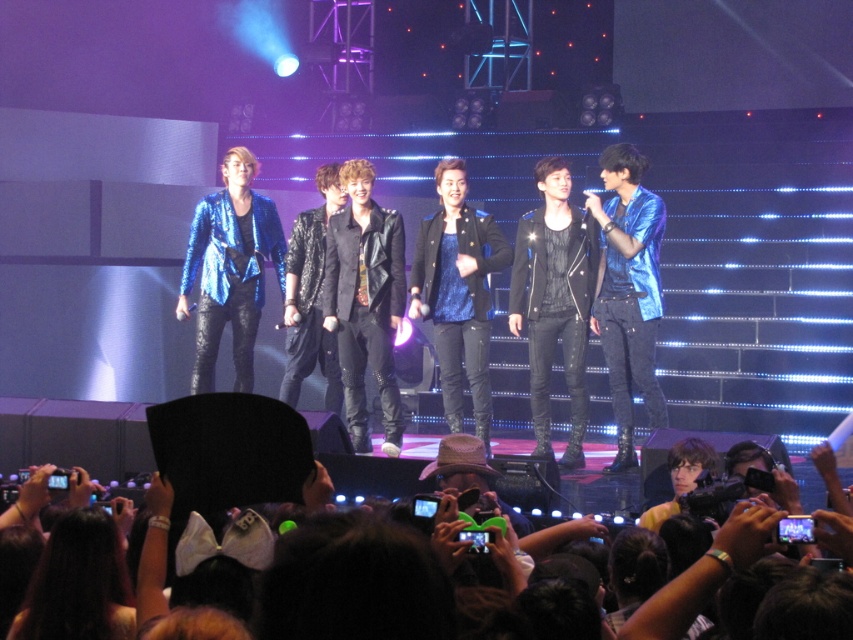
Which of these two, shiny metallic jackets at center or black fabric hat at lower center, stands taller?

Standing taller between the two is shiny metallic jackets at center.

Does shiny metallic jackets at center have a greater height compared to black fabric hat at lower center?

Correct, shiny metallic jackets at center is much taller as black fabric hat at lower center.

Between point (328, 232) and point (677, 616), which one is positioned in front?

Point (677, 616) is in front.

Find the location of a particular element. shiny metallic jackets at center is located at coordinates (532, 292).

This screenshot has height=640, width=853. I want to click on shiny metallic jackets at center, so click(532, 292).

Who is more distant from viewer, (656, 234) or (642, 250)?

Positioned behind is point (656, 234).

What do you see at coordinates (532, 292) in the screenshot? The image size is (853, 640). I see `shiny metallic jackets at center` at bounding box center [532, 292].

Locate an element on the screen. shiny metallic jackets at center is located at coordinates (532, 292).

Is point (697, 577) more distant than point (633, 195)?

That is False.

Which of these two, black fabric hat at lower center or shiny blue jacket at right, stands taller?

shiny blue jacket at right

Describe the element at coordinates (706, 572) in the screenshot. The width and height of the screenshot is (853, 640). I see `black fabric hat at lower center` at that location.

Locate an element on the screen. black fabric hat at lower center is located at coordinates (706, 572).